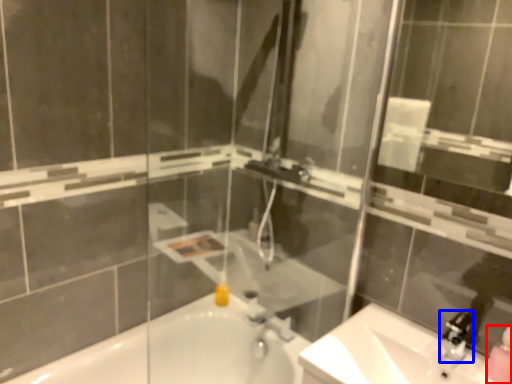
Question: Which of the following is the closest to the observer, soap dispenser (highlighted by a red box) or faucet (highlighted by a blue box)?

Choices:
 (A) soap dispenser
 (B) faucet

Answer: (A)